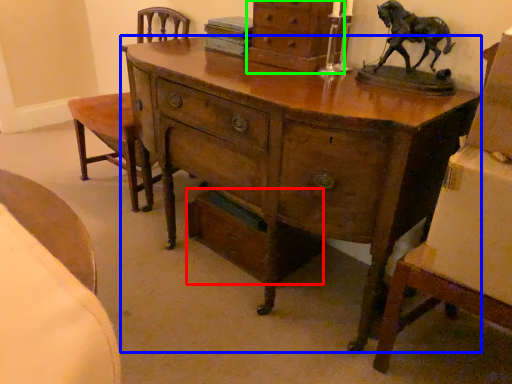
Question: Which object is positioned farthest from drawer (highlighted by a red box)? Select from desk (highlighted by a blue box) and chest of drawers (highlighted by a green box).

Choices:
 (A) desk
 (B) chest of drawers

Answer: (B)